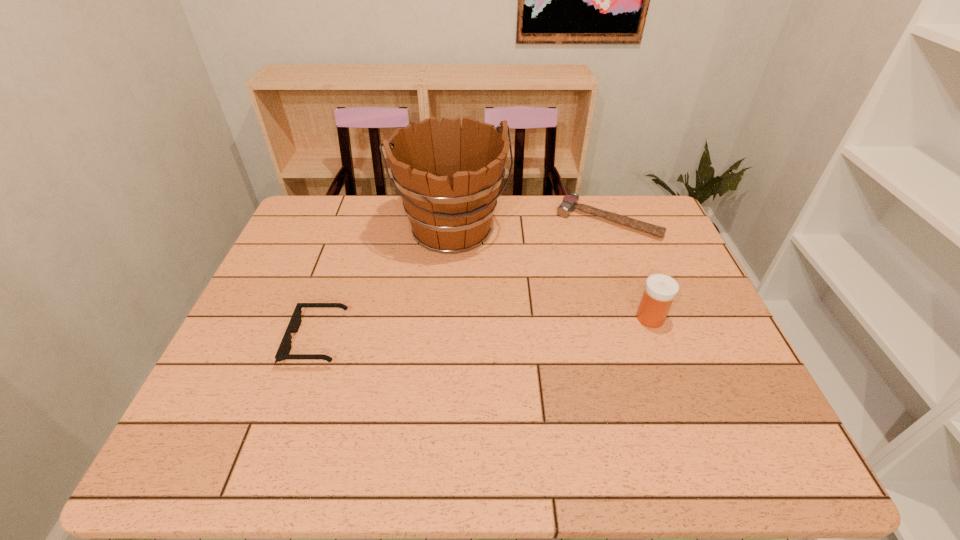
You are a GUI agent. You are given a task and a screenshot of the screen. Output one action in this format:
    pyautogui.click(x=<x>, y=<y>)
    Task: Click on the vacant position located with the handle on the second object from left to right
    The width and height of the screenshot is (960, 540).
    Given the screenshot: What is the action you would take?
    coord(479,285)

Find the location of a particular element. free space located 0.390m with the handle on the second object from left to right is located at coordinates (518, 372).

In order to click on vacant space located on the striking face of the hammer in this screenshot , I will do `click(579, 249)`.

This screenshot has height=540, width=960. Find the location of `vacant region located 0.350m on the striking face of the hammer`. vacant region located 0.350m on the striking face of the hammer is located at coordinates (536, 309).

Locate an element on the screen. The height and width of the screenshot is (540, 960). free location located 0.310m on the striking face of the hammer is located at coordinates (542, 300).

You are a GUI agent. You are given a task and a screenshot of the screen. Output one action in this format:
    pyautogui.click(x=<x>, y=<y>)
    Task: Click on the wine bucket that is at the far edge
    
    Given the screenshot: What is the action you would take?
    pyautogui.click(x=448, y=177)

At what (x,y) coordinates should I click in order to perform the action: click on hammer at the far edge. Please return your answer as a coordinate pair (x, y). This screenshot has width=960, height=540. Looking at the image, I should click on (569, 203).

Where is `object present at the left edge`? This screenshot has width=960, height=540. object present at the left edge is located at coordinates (283, 351).

The height and width of the screenshot is (540, 960). Find the location of `medicine present at the right edge`. medicine present at the right edge is located at coordinates (660, 289).

Locate an element on the screen. hammer present at the right edge is located at coordinates (569, 203).